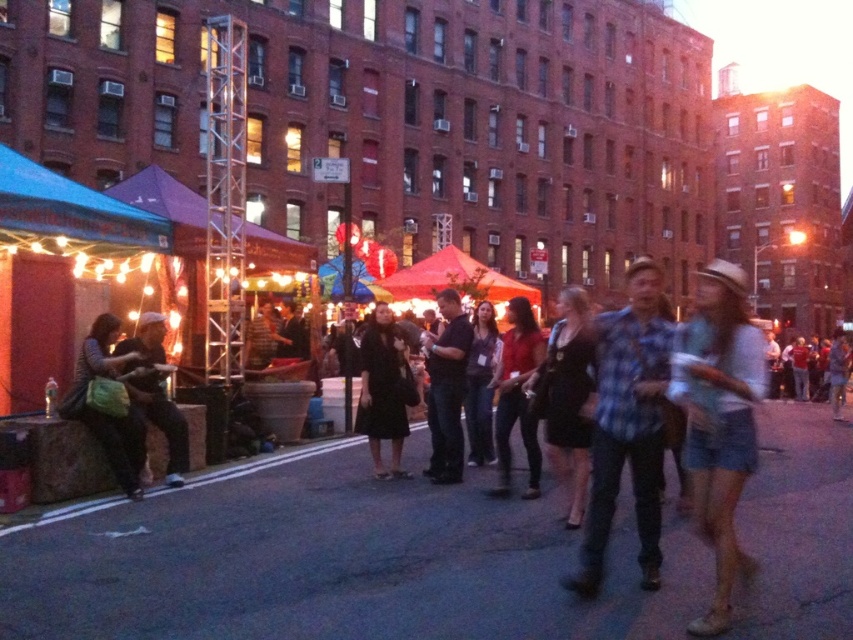
You are standing at the point labeled as point (474, 422) in the image. There is a food stall located at point (570, 515). Can you walk directly towards the food stall without moving around any obstacles?

Yes, you can walk directly towards the food stall located at point (570, 515) because it is in front of your current position at point (474, 422), meaning there are no obstacles blocking the path between them.

Looking at this image, you are a fashion designer attending the street fair and see both the black leather dress at center and the dark gray fabric jacket at center. You need to decide if you can comfortably carry both items while walking through the crowd. Assuming you can carry items within 2 meters apart, can you manage?

The distance between the black leather dress at center and the dark gray fabric jacket at center is 1.76 meters, which is within the 2 meters limit. Therefore, you can comfortably carry both items while walking through the crowd.